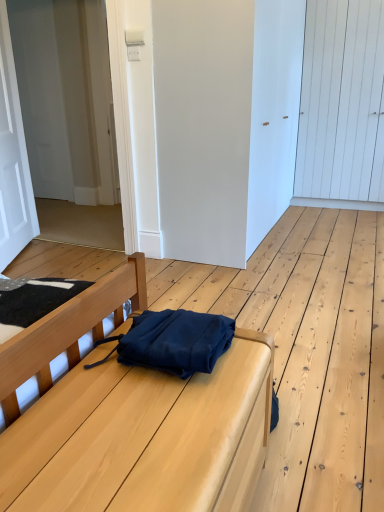
The width and height of the screenshot is (384, 512). What do you see at coordinates (13, 158) in the screenshot? I see `white matte door at left, the first door when ordered from left to right` at bounding box center [13, 158].

What do you see at coordinates (342, 105) in the screenshot? I see `white wooden door at upper right, acting as the fourth door starting from the left` at bounding box center [342, 105].

In order to click on navy blue fabric messenger bag at center in this screenshot , I will do `click(173, 341)`.

At what (x,y) coordinates should I click in order to perform the action: click on white matte door at left, the first door when ordered from left to right. Please return your answer as a coordinate pair (x, y). The height and width of the screenshot is (512, 384). Looking at the image, I should click on (13, 158).

Considering the sizes of objects white matte door at left, the first door when ordered from left to right, and white matte door at upper left, the 3th door viewed from the right, in the image provided, who is taller, white matte door at left, the first door when ordered from left to right, or white matte door at upper left, the 3th door viewed from the right,?

white matte door at upper left, the 3th door viewed from the right, is taller.

Is white matte door at left, positioned as the 4th door in right-to-left order, turned away from white matte door at upper left, which is counted as the second door, starting from the left?

Yes, white matte door at upper left, which is counted as the second door, starting from the left, is at the back of white matte door at left, positioned as the 4th door in right-to-left order.

Find the location of a particular element. The width and height of the screenshot is (384, 512). the 2nd door behind the white matte door at left, the first door when ordered from left to right, counting from the anchor's position is located at coordinates (66, 98).

Is navy blue fabric messenger bag at center completely or partially outside of white matte door at center, the second door viewed from the right?

Yes, navy blue fabric messenger bag at center is outside of white matte door at center, the second door viewed from the right.

Which is in front, point (181, 370) or point (172, 167)?

The point (181, 370) is more forward.

Is navy blue fabric messenger bag at center next to white matte door at center, which is the third door in left-to-right order, and touching it?

navy blue fabric messenger bag at center and white matte door at center, which is the third door in left-to-right order, are not in contact.

From a real-world perspective, is navy blue fabric messenger bag at center physically located above or below white matte door at center, which is the third door in left-to-right order?

From a real-world perspective, navy blue fabric messenger bag at center is physically below white matte door at center, which is the third door in left-to-right order.

Considering the relative sizes of white matte door at left, the first door when ordered from left to right, and navy blue fabric at center in the image provided, is white matte door at left, the first door when ordered from left to right, taller than navy blue fabric at center?

Indeed, white matte door at left, the first door when ordered from left to right, has a greater height compared to navy blue fabric at center.

Can navy blue fabric at center be found inside white matte door at left, positioned as the 4th door in right-to-left order?

That's incorrect, navy blue fabric at center is not inside white matte door at left, positioned as the 4th door in right-to-left order.

Which is more to the left, white matte door at left, positioned as the 4th door in right-to-left order, or navy blue fabric at center?

Positioned to the left is white matte door at left, positioned as the 4th door in right-to-left order.

Is white matte door at left, the first door when ordered from left to right, positioned behind navy blue fabric at center?

That is True.

Between navy blue fabric at center and white matte door at center, the second door viewed from the right, which one appears on the right side from the viewer's perspective?

From the viewer's perspective, white matte door at center, the second door viewed from the right, appears more on the right side.

Considering the relative sizes of navy blue fabric at center and white matte door at center, the second door viewed from the right, in the image provided, is navy blue fabric at center taller than white matte door at center, the second door viewed from the right,?

No.

What's the angular difference between navy blue fabric at center and white matte door at center, the second door viewed from the right,'s facing directions?

0.182 degrees separate the facing orientations of navy blue fabric at center and white matte door at center, the second door viewed from the right.

Would you consider navy blue fabric at center to be distant from white matte door at center, which is the third door in left-to-right order?

navy blue fabric at center is far away from white matte door at center, which is the third door in left-to-right order.

Based on the photo, from a real-world perspective, which object rests below the other?

navy blue fabric messenger bag at center.

Considering the sizes of navy blue fabric messenger bag at center and white wooden door at upper right, acting as the fourth door starting from the left, in the image, is navy blue fabric messenger bag at center bigger or smaller than white wooden door at upper right, acting as the fourth door starting from the left,?

Clearly, navy blue fabric messenger bag at center is smaller in size than white wooden door at upper right, acting as the fourth door starting from the left.

The width and height of the screenshot is (384, 512). Identify the location of the 4th door behind the navy blue fabric messenger bag at center, starting your count from the anchor. (342, 105).

From the image's perspective, does navy blue fabric at center appear higher than white matte door at left, positioned as the 4th door in right-to-left order?

No, from the image's perspective, navy blue fabric at center is not above white matte door at left, positioned as the 4th door in right-to-left order.

Are navy blue fabric at center and white matte door at left, positioned as the 4th door in right-to-left order, making contact?

navy blue fabric at center is not next to white matte door at left, positioned as the 4th door in right-to-left order, and they're not touching.

Is navy blue fabric at center positioned with its back to white matte door at left, the first door when ordered from left to right?

No, navy blue fabric at center's orientation is not away from white matte door at left, the first door when ordered from left to right.

Between navy blue fabric at center and white matte door at left, positioned as the 4th door in right-to-left order, which one has smaller width?

white matte door at left, positioned as the 4th door in right-to-left order.

Is navy blue fabric at center far from white wooden door at upper right, acting as the fourth door starting from the left?

Indeed, navy blue fabric at center is not near white wooden door at upper right, acting as the fourth door starting from the left.

Is navy blue fabric at center aimed at white wooden door at upper right, acting as the fourth door starting from the left?

No, navy blue fabric at center does not turn towards white wooden door at upper right, acting as the fourth door starting from the left.

Between navy blue fabric at center and white wooden door at upper right, which is the 1th door in right-to-left order, which one appears on the left side from the viewer's perspective?

navy blue fabric at center is more to the left.

From a real-world perspective, is navy blue fabric at center positioned above or below white wooden door at upper right, which is the 1th door in right-to-left order?

From a real-world perspective, navy blue fabric at center is physically below white wooden door at upper right, which is the 1th door in right-to-left order.

Where is `door that is the 2nd object located behind the white matte door at left, positioned as the 4th door in right-to-left order`? The height and width of the screenshot is (512, 384). door that is the 2nd object located behind the white matte door at left, positioned as the 4th door in right-to-left order is located at coordinates (66, 98).

Identify the location of the 1st door to the right of the navy blue fabric messenger bag at center, counting from the anchor's position. (203, 126).

Based on their spatial positions, is white matte door at upper left, which is counted as the second door, starting from the left, or white matte door at left, positioned as the 4th door in right-to-left order, further from navy blue fabric messenger bag at center?

white matte door at upper left, which is counted as the second door, starting from the left.

Based on their spatial positions, is navy blue fabric at center or white wooden door at upper right, acting as the fourth door starting from the left, closer to navy blue fabric messenger bag at center?

The object closer to navy blue fabric messenger bag at center is navy blue fabric at center.

Based on their spatial positions, is white matte door at left, the first door when ordered from left to right, or white matte door at center, which is the third door in left-to-right order, further from navy blue fabric at center?

white matte door at left, the first door when ordered from left to right, is positioned further to the anchor navy blue fabric at center.

Which object lies further to the anchor point white matte door at center, which is the third door in left-to-right order, navy blue fabric at center or white wooden door at upper right, acting as the fourth door starting from the left?

navy blue fabric at center lies further to white matte door at center, which is the third door in left-to-right order, than the other object.

From the image, which object appears to be farther from white matte door at center, the second door viewed from the right, navy blue fabric messenger bag at center or white wooden door at upper right, acting as the fourth door starting from the left?

Among the two, white wooden door at upper right, acting as the fourth door starting from the left, is located further to white matte door at center, the second door viewed from the right.

From the picture: When comparing their distances from white matte door at center, the second door viewed from the right, does navy blue fabric messenger bag at center or navy blue fabric at center seem further?

navy blue fabric at center.

Considering their positions, is white matte door at center, which is the third door in left-to-right order, positioned closer to navy blue fabric at center than white wooden door at upper right, which is the 1th door in right-to-left order?

white matte door at center, which is the third door in left-to-right order, is closer to navy blue fabric at center.

In the scene shown: Looking at the image, which one is located closer to white matte door at left, the first door when ordered from left to right, white wooden door at upper right, acting as the fourth door starting from the left, or white matte door at center, which is the third door in left-to-right order?

white matte door at center, which is the third door in left-to-right order, lies closer to white matte door at left, the first door when ordered from left to right, than the other object.

The width and height of the screenshot is (384, 512). I want to click on furniture between white matte door at left, the first door when ordered from left to right, and white wooden door at upper right, which is the 1th door in right-to-left order, from left to right, so click(x=144, y=437).

Locate an element on the screen. The image size is (384, 512). messenger bag between navy blue fabric at center and white matte door at left, the first door when ordered from left to right, along the z-axis is located at coordinates (173, 341).

I want to click on messenger bag located between white matte door at upper left, which is counted as the second door, starting from the left, and white wooden door at upper right, which is the 1th door in right-to-left order, in the left-right direction, so [x=173, y=341].

This screenshot has width=384, height=512. Find the location of `messenger bag between navy blue fabric at center and white matte door at upper left, the 3th door viewed from the right, in the front-back direction`. messenger bag between navy blue fabric at center and white matte door at upper left, the 3th door viewed from the right, in the front-back direction is located at coordinates (173, 341).